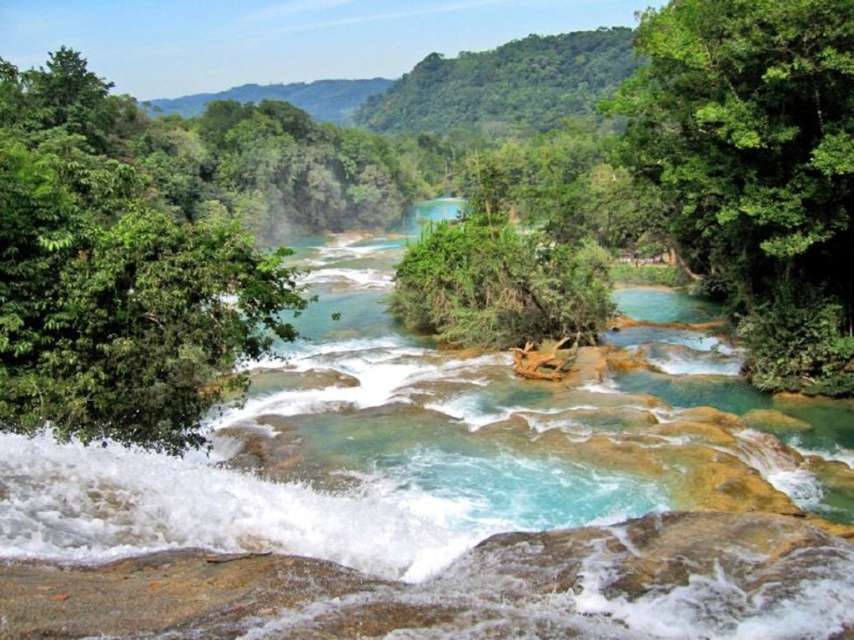
Between green leafy tree at left and green leafy tree at upper right, which one has less height?

With less height is green leafy tree at upper right.

Does green leafy tree at left appear on the left side of green leafy tree at upper right?

Indeed, green leafy tree at left is positioned on the left side of green leafy tree at upper right.

What do you see at coordinates (117, 272) in the screenshot?
I see `green leafy tree at left` at bounding box center [117, 272].

The height and width of the screenshot is (640, 854). I want to click on green leafy tree at left, so click(x=117, y=272).